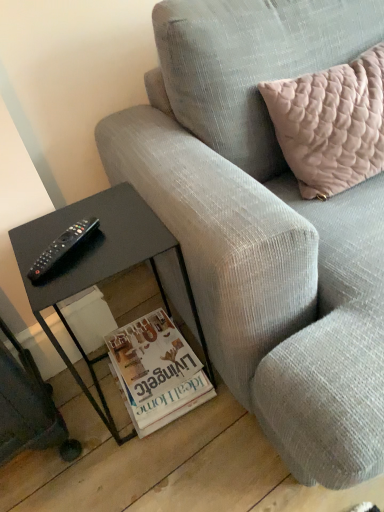
Question: Considering the relative sizes of gray corduroy couch at center and pale pink quilted cushion at upper right in the image provided, is gray corduroy couch at center bigger than pale pink quilted cushion at upper right?

Choices:
 (A) yes
 (B) no

Answer: (A)

Question: Are gray corduroy couch at center and pale pink quilted cushion at upper right beside each other?

Choices:
 (A) no
 (B) yes

Answer: (A)

Question: Is gray corduroy couch at center thinner than pale pink quilted cushion at upper right?

Choices:
 (A) no
 (B) yes

Answer: (A)

Question: Are gray corduroy couch at center and pale pink quilted cushion at upper right located far from each other?

Choices:
 (A) no
 (B) yes

Answer: (A)

Question: From the image's perspective, would you say gray corduroy couch at center is positioned over pale pink quilted cushion at upper right?

Choices:
 (A) no
 (B) yes

Answer: (A)

Question: Considering the positions of pale pink quilted cushion at upper right and black plastic remote at left in the image, is pale pink quilted cushion at upper right taller or shorter than black plastic remote at left?

Choices:
 (A) short
 (B) tall

Answer: (B)

Question: From a real-world perspective, is pale pink quilted cushion at upper right physically located above or below black plastic remote at left?

Choices:
 (A) above
 (B) below

Answer: (B)

Question: Is pale pink quilted cushion at upper right spatially inside black plastic remote at left, or outside of it?

Choices:
 (A) outside
 (B) inside

Answer: (A)

Question: Is point (311, 143) closer or farther from the camera than point (72, 232)?

Choices:
 (A) closer
 (B) farther

Answer: (B)

Question: Considering the positions of point (311, 373) and point (72, 234), is point (311, 373) closer or farther from the camera than point (72, 234)?

Choices:
 (A) farther
 (B) closer

Answer: (B)

Question: In terms of size, does gray corduroy couch at center appear bigger or smaller than black plastic remote at left?

Choices:
 (A) small
 (B) big

Answer: (B)

Question: Visually, is gray corduroy couch at center positioned to the left or to the right of black plastic remote at left?

Choices:
 (A) left
 (B) right

Answer: (B)

Question: Looking at their shapes, would you say gray corduroy couch at center is wider or thinner than black plastic remote at left?

Choices:
 (A) thin
 (B) wide

Answer: (B)

Question: Based on their positions, is black plastic remote at left located to the left or right of pale pink quilted cushion at upper right?

Choices:
 (A) right
 (B) left

Answer: (B)

Question: Considering the positions of point (89, 224) and point (321, 142), is point (89, 224) closer or farther from the camera than point (321, 142)?

Choices:
 (A) closer
 (B) farther

Answer: (A)